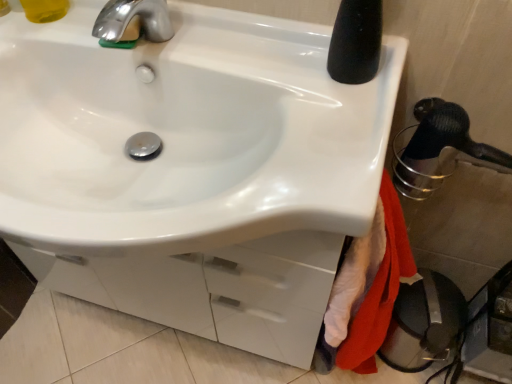
Where is `unoccupied region to the right of shiny metallic faucet at upper left`? This screenshot has height=384, width=512. unoccupied region to the right of shiny metallic faucet at upper left is located at coordinates (208, 45).